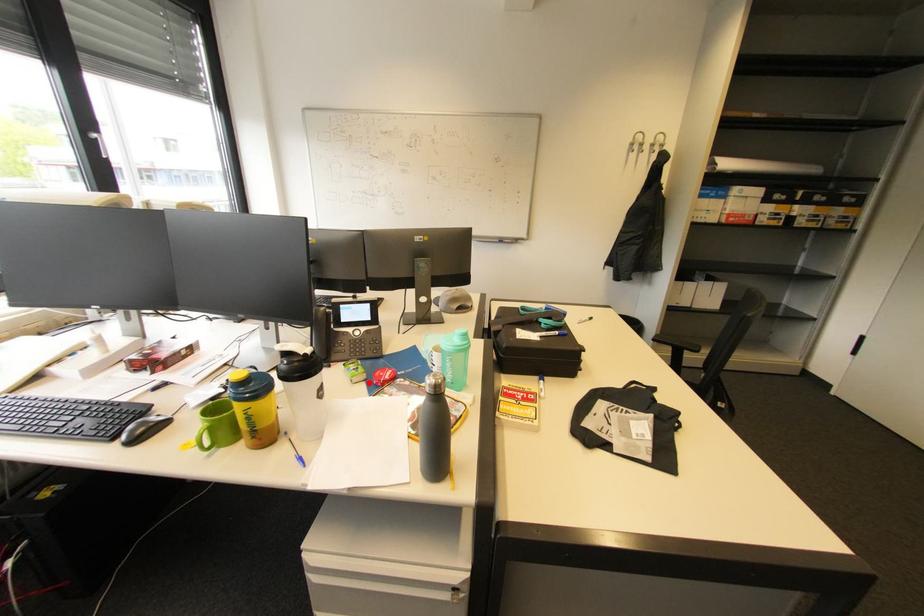
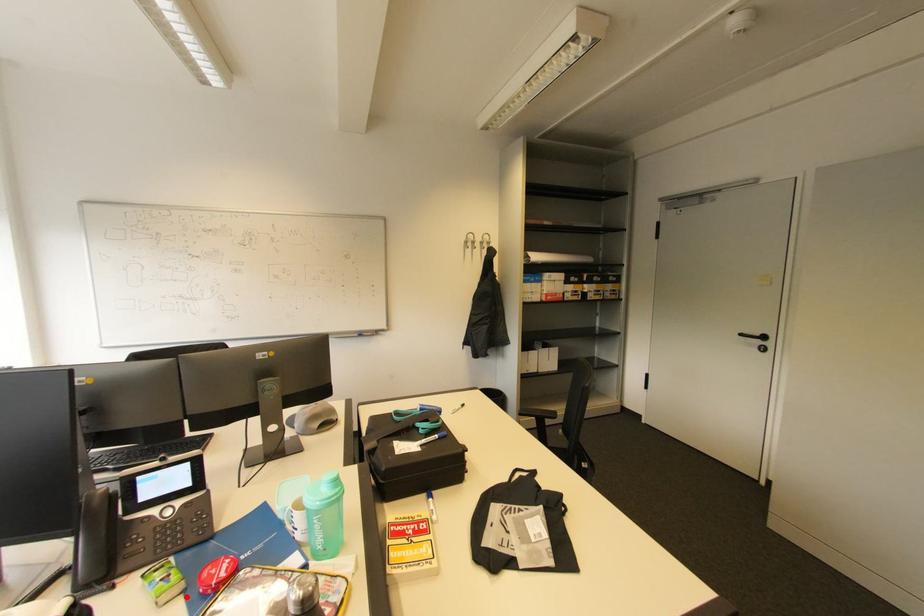
I am providing you with two images of the same scene from different viewpoints. A red point is marked on the first image and another point is marked on the second image. Are the points marked in image1 and image2 representing the same 3D position?

Yes